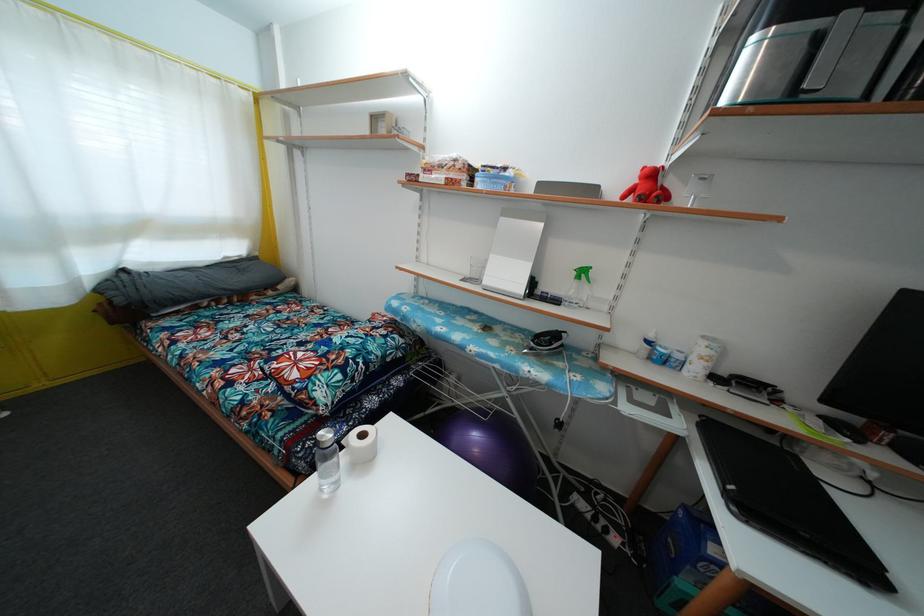
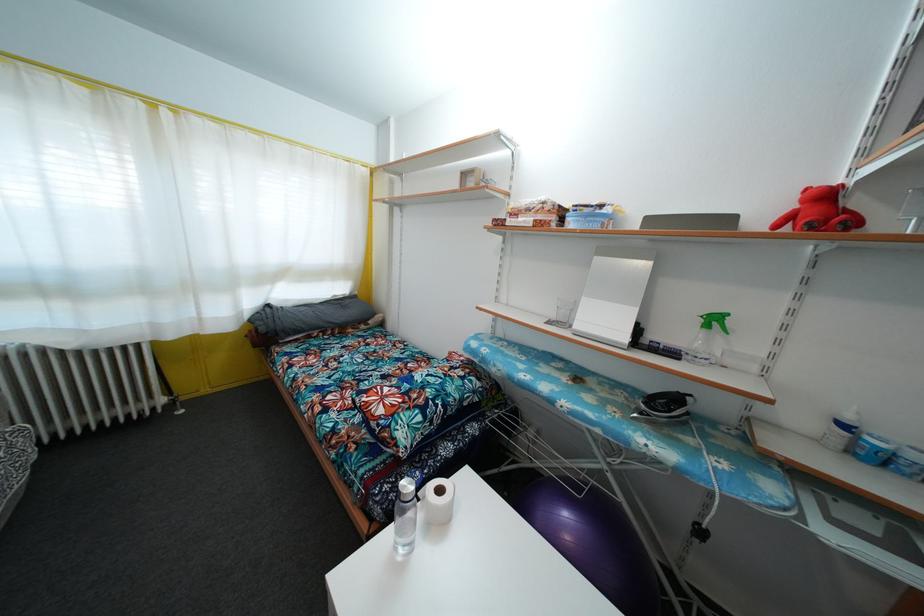
In the second image, find the point that corresponds to pixel 330 440 in the first image.

(410, 492)